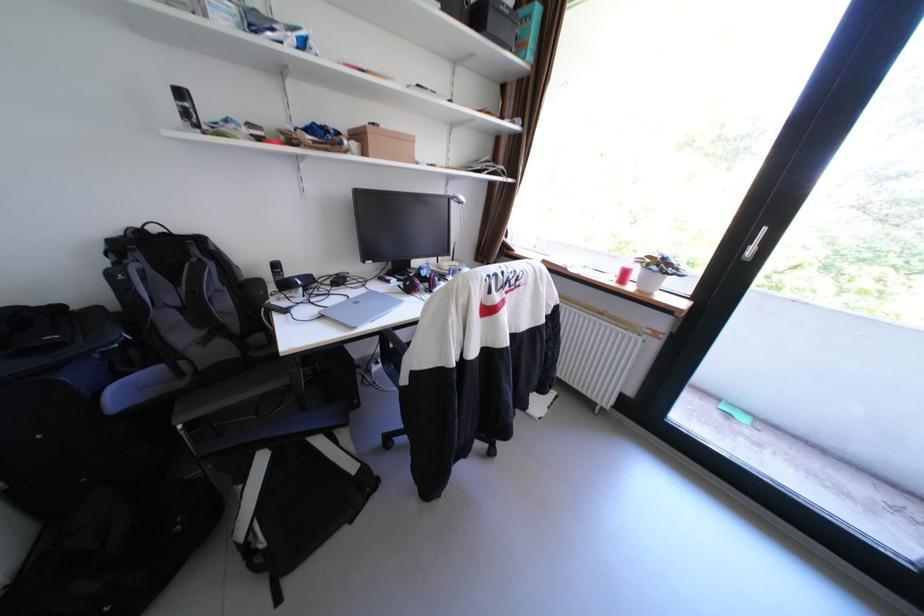
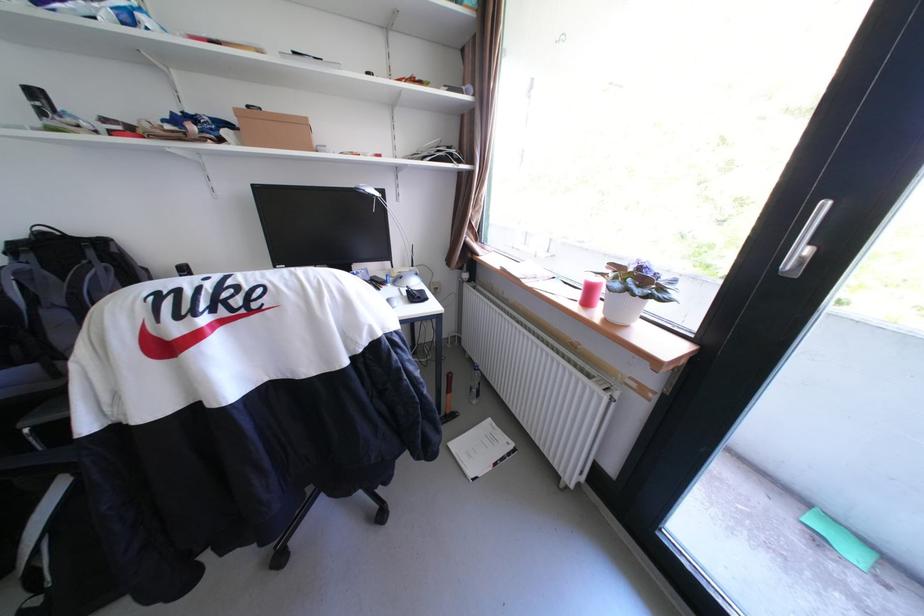
The point at [641,288] is marked in the first image. Where is the corresponding point in the second image?

(608, 313)